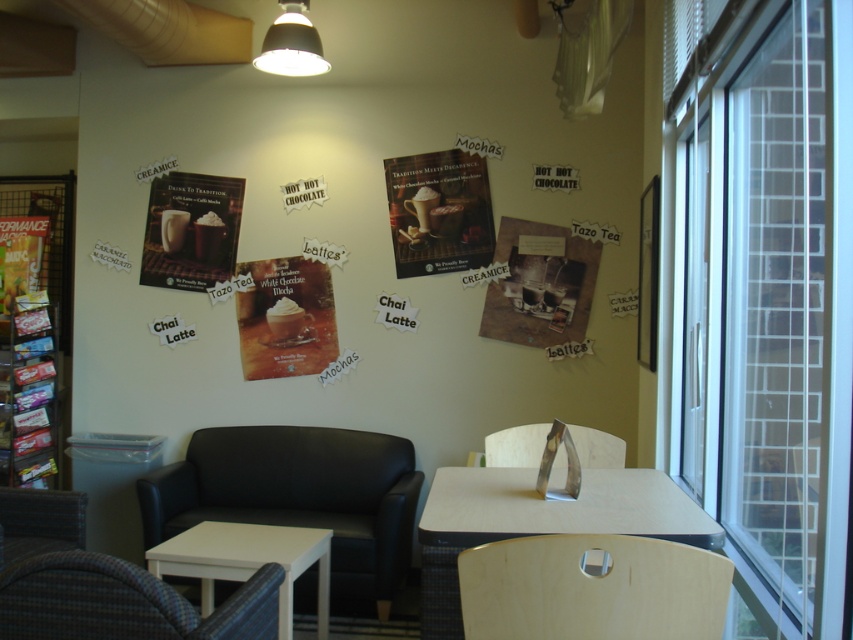
You are standing in the cafe and want to take a photo of the point at coordinates (x=699, y=566). Your camera has a focal length of 50mm and a sensor size of 24mm. What is the minimum distance you need to be from the point to ensure it fills the frame?

The point at coordinates (x=699, y=566) is 1.41 meters away from the camera. To calculate the minimum distance required, use the formula distance_sensor_to_subject divided by sensor size multiplied by focal length. Here, 1.41 meters divided by 24mm multiplied by 50mm equals approximately 2.94 meters. Therefore, you need to be at least 2.94 meters away to ensure the point fills the frame.

You are a customer entering the cafe and want to sit down. You see the light brown wood armchair at lower right and the matte white poster at center. Which one is narrower in width?

The light brown wood armchair at lower right is thinner than the matte white poster at center, so the light brown wood armchair at lower right is narrower in width.

You are a customer entering the cozy cafe and looking at the matte paper poster at center and the matte green poster at left. Which poster is closer to the floor?

The matte paper poster at center is closer to the floor because it is positioned under the matte green poster at left.